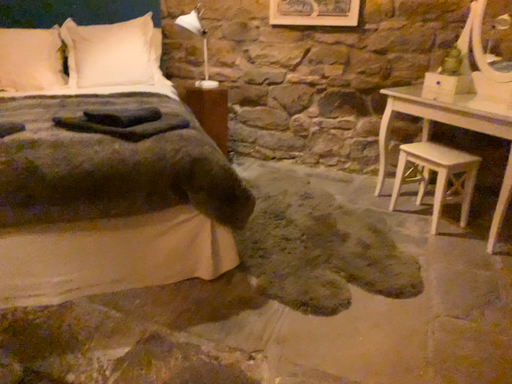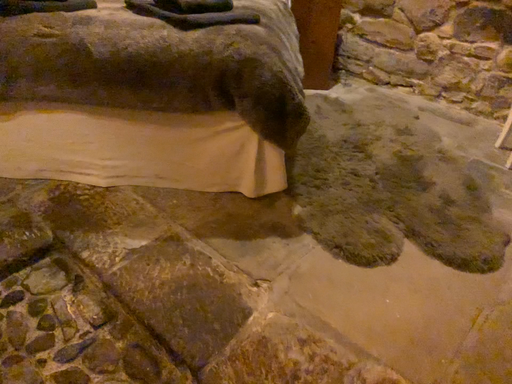
Question: How did the camera likely rotate when shooting the video?

Choices:
 (A) rotated left
 (B) rotated right

Answer: (A)